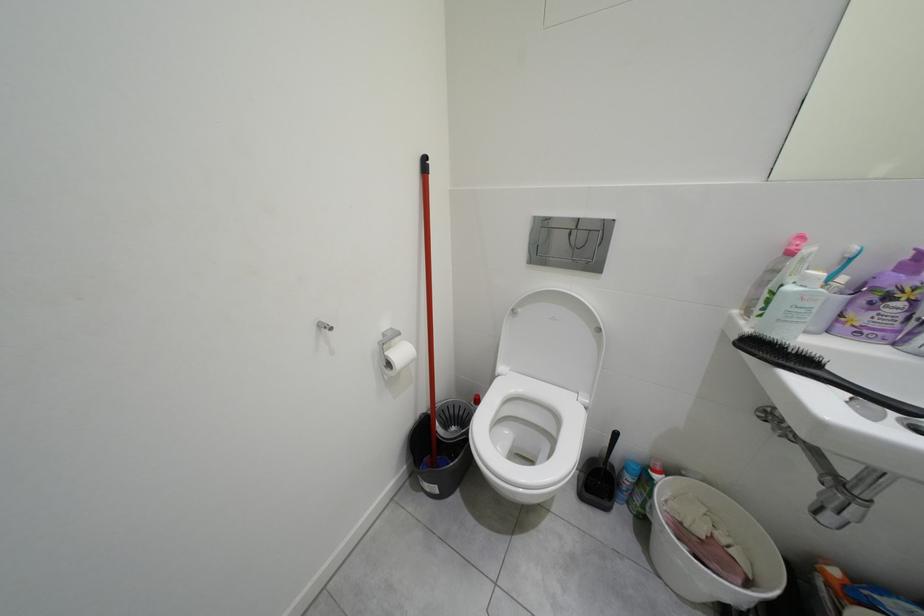
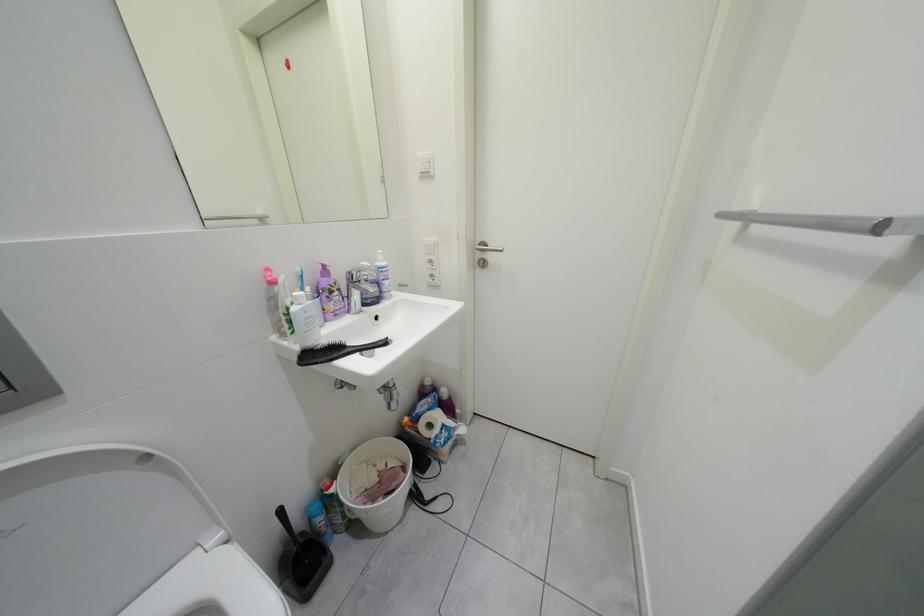
How did the camera likely rotate?

The rotation direction of the camera is right-down.